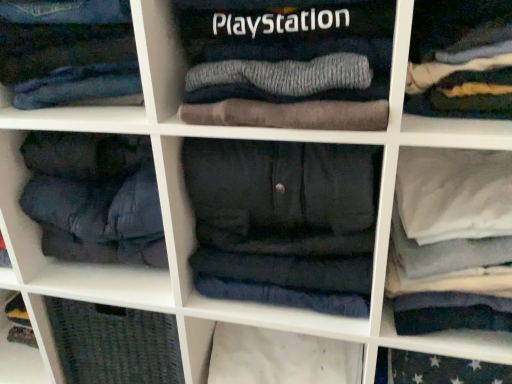
Question: Considering the positions of dark gray fleece pants at center, which ranks as the first clothing in bottom-to-top order, and denim jeans at upper center, marked as the second clothing in a bottom-to-top arrangement, in the image, is dark gray fleece pants at center, which ranks as the first clothing in bottom-to-top order, wider or thinner than denim jeans at upper center, marked as the second clothing in a bottom-to-top arrangement,?

Choices:
 (A) wide
 (B) thin

Answer: (A)

Question: From the image's perspective, is dark gray fleece pants at center, which is counted as the 2th clothing, starting from the top, located above or below denim jeans at upper center, the first clothing viewed from the top?

Choices:
 (A) below
 (B) above

Answer: (A)

Question: Is dark gray fleece pants at center, arranged as the 1th clothing when viewed from the right, bigger or smaller than denim jeans at upper center, marked as the second clothing in a bottom-to-top arrangement?

Choices:
 (A) small
 (B) big

Answer: (B)

Question: Considering the relative positions of denim jeans at upper center, marked as the second clothing in a bottom-to-top arrangement, and dark gray fleece pants at center, which ranks as the first clothing in bottom-to-top order, in the image provided, is denim jeans at upper center, marked as the second clothing in a bottom-to-top arrangement, to the left or to the right of dark gray fleece pants at center, which ranks as the first clothing in bottom-to-top order,?

Choices:
 (A) left
 (B) right

Answer: (A)

Question: Looking at their shapes, would you say denim jeans at upper center, positioned as the first clothing in left-to-right order, is wider or thinner than dark gray fleece pants at center, which is counted as the second clothing, starting from the left?

Choices:
 (A) thin
 (B) wide

Answer: (A)

Question: Looking at the image, does denim jeans at upper center, positioned as the first clothing in left-to-right order, seem bigger or smaller compared to dark gray fleece pants at center, which ranks as the first clothing in bottom-to-top order?

Choices:
 (A) small
 (B) big

Answer: (A)

Question: Is point (71, 8) closer or farther from the camera than point (370, 215)?

Choices:
 (A) closer
 (B) farther

Answer: (A)